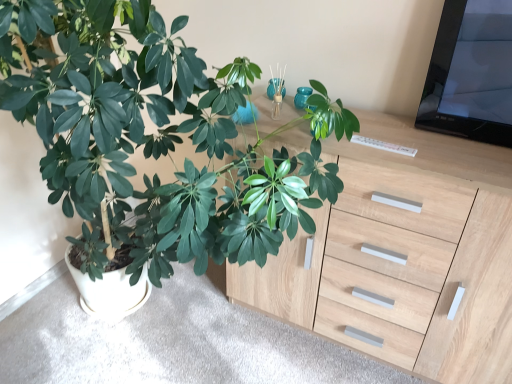
Question: Could matte wood cabinet at lower center be considered to be inside light wood chest of drawers at center?

Choices:
 (A) no
 (B) yes

Answer: (A)

Question: From a real-world perspective, does light wood chest of drawers at center sit lower than matte wood cabinet at lower center?

Choices:
 (A) no
 (B) yes

Answer: (A)

Question: Considering the relative positions of light wood chest of drawers at center and matte wood cabinet at lower center in the image provided, is light wood chest of drawers at center in front of matte wood cabinet at lower center?

Choices:
 (A) no
 (B) yes

Answer: (B)

Question: From the image's perspective, is light wood chest of drawers at center on top of matte wood cabinet at lower center?

Choices:
 (A) no
 (B) yes

Answer: (B)

Question: Is light wood chest of drawers at center outside matte wood cabinet at lower center?

Choices:
 (A) no
 (B) yes

Answer: (B)

Question: Would you say green matte plant at left is inside or outside light wood chest of drawers at center?

Choices:
 (A) outside
 (B) inside

Answer: (A)

Question: Is point (99, 84) positioned closer to the camera than point (397, 266)?

Choices:
 (A) closer
 (B) farther

Answer: (A)

Question: Considering the positions of green matte plant at left and light wood chest of drawers at center in the image, is green matte plant at left wider or thinner than light wood chest of drawers at center?

Choices:
 (A) thin
 (B) wide

Answer: (B)

Question: Is green matte plant at left to the left or to the right of light wood chest of drawers at center in the image?

Choices:
 (A) right
 (B) left

Answer: (B)

Question: Is matte wood cabinet at lower center in front of or behind light wood chest of drawers at center in the image?

Choices:
 (A) behind
 (B) front

Answer: (A)

Question: Considering the positions of matte wood cabinet at lower center and light wood chest of drawers at center in the image, is matte wood cabinet at lower center taller or shorter than light wood chest of drawers at center?

Choices:
 (A) tall
 (B) short

Answer: (B)

Question: From the image's perspective, relative to light wood chest of drawers at center, is matte wood cabinet at lower center above or below?

Choices:
 (A) below
 (B) above

Answer: (A)

Question: Is matte wood cabinet at lower center wider or thinner than light wood chest of drawers at center?

Choices:
 (A) thin
 (B) wide

Answer: (B)

Question: Looking at their shapes, would you say light wood chest of drawers at center is wider or thinner than green matte plant at left?

Choices:
 (A) wide
 (B) thin

Answer: (B)

Question: Based on their positions, is light wood chest of drawers at center located to the left or right of green matte plant at left?

Choices:
 (A) left
 (B) right

Answer: (B)